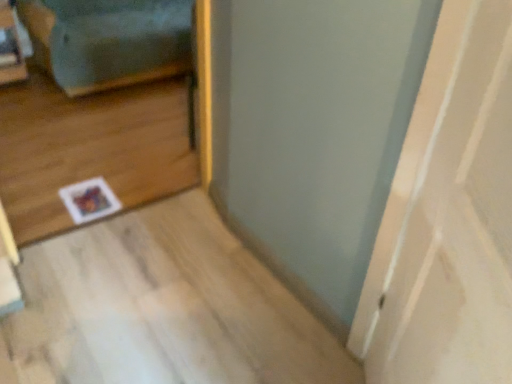
Where is `white matte door at center`? white matte door at center is located at coordinates (448, 217).

Describe the element at coordinates (448, 217) in the screenshot. I see `white matte door at center` at that location.

Based on the photo, measure the distance between point (68, 20) and camera.

Point (68, 20) is 8.60 feet from camera.

The height and width of the screenshot is (384, 512). In order to click on blue fabric couch at left in this screenshot , I will do 108,41.

Image resolution: width=512 pixels, height=384 pixels. What do you see at coordinates (108, 41) in the screenshot? I see `blue fabric couch at left` at bounding box center [108, 41].

Locate an element on the screen. white matte door at center is located at coordinates (448, 217).

Considering the relative positions of white matte door at center and blue fabric couch at left in the image provided, is white matte door at center to the left or to the right of blue fabric couch at left?

In the image, white matte door at center appears on the right side of blue fabric couch at left.

Is white matte door at center further to camera compared to blue fabric couch at left?

No.

Between point (509, 82) and point (170, 9), which one is positioned in front?

Point (509, 82)

From the image's perspective, which is below, white matte door at center or blue fabric couch at left?

white matte door at center, from the image's perspective.

From a real-world perspective, between white matte door at center and blue fabric couch at left, who is vertically higher?

white matte door at center.

Does white matte door at center have a lesser width compared to blue fabric couch at left?

Yes.

Does white matte door at center have a greater height compared to blue fabric couch at left?

Indeed, white matte door at center has a greater height compared to blue fabric couch at left.

Looking at the image, does white matte door at center seem bigger or smaller compared to blue fabric couch at left?

Clearly, white matte door at center is smaller in size than blue fabric couch at left.

Which is correct: white matte door at center is inside blue fabric couch at left, or outside of it?

white matte door at center is not inside blue fabric couch at left, it's outside.

Are white matte door at center and blue fabric couch at left beside each other?

No, white matte door at center is not beside blue fabric couch at left.

Consider the image. Could you tell me if white matte door at center is facing blue fabric couch at left?

No, white matte door at center is not turned towards blue fabric couch at left.

Based on the photo, how many degrees apart are the facing directions of white matte door at center and blue fabric couch at left?

The angle between the facing direction of white matte door at center and the facing direction of blue fabric couch at left is 129 degrees.

Measure the distance from white matte door at center to blue fabric couch at left.

white matte door at center and blue fabric couch at left are 2.43 meters apart from each other.

The height and width of the screenshot is (384, 512). I want to click on couch above the white matte door at center (from the image's perspective), so click(108, 41).

Is blue fabric couch at left to the left or to the right of white matte door at center in the image?

blue fabric couch at left is positioned on white matte door at center's left side.

Relative to white matte door at center, is blue fabric couch at left in front or behind?

Clearly, blue fabric couch at left is behind white matte door at center.

Which is more distant, (x=184, y=20) or (x=479, y=346)?

Positioned behind is point (x=184, y=20).

From the image's perspective, is blue fabric couch at left on white matte door at center?

Correct, blue fabric couch at left appears higher than white matte door at center in the image.

From a real-world perspective, is blue fabric couch at left physically located above or below white matte door at center?

blue fabric couch at left is situated lower than white matte door at center in the real world.

Which of these two, blue fabric couch at left or white matte door at center, is wider?

Wider between the two is blue fabric couch at left.

Can you confirm if blue fabric couch at left is taller than white matte door at center?

No, blue fabric couch at left is not taller than white matte door at center.

Looking at this image, in terms of size, does blue fabric couch at left appear bigger or smaller than white matte door at center?

blue fabric couch at left is bigger than white matte door at center.

Can we say blue fabric couch at left lies outside white matte door at center?

Yes, blue fabric couch at left is located beyond the bounds of white matte door at center.

Looking at this image, is blue fabric couch at left next to white matte door at center?

No.

Does blue fabric couch at left turn towards white matte door at center?

Yes, blue fabric couch at left faces towards white matte door at center.

Can you tell me how much blue fabric couch at left and white matte door at center differ in facing direction?

→ 129 degrees.

Locate an element on the screen. door lying below the blue fabric couch at left (from the image's perspective) is located at coordinates (448, 217).

Locate an element on the screen. The height and width of the screenshot is (384, 512). couch below the white matte door at center (from a real-world perspective) is located at coordinates (108, 41).

In order to click on door that appears on the right of blue fabric couch at left in this screenshot , I will do `click(448, 217)`.